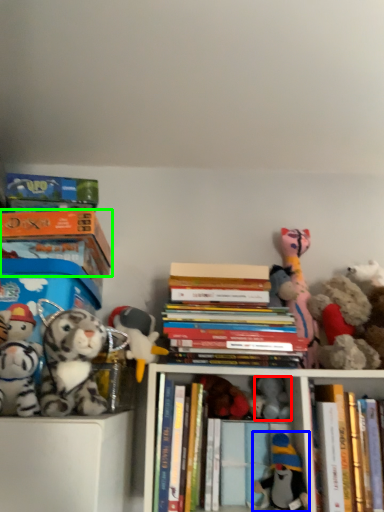
Question: Based on their relative distances, which object is farther from toy (highlighted by a red box)? Choose from toy (highlighted by a blue box) and book (highlighted by a green box).

Choices:
 (A) toy
 (B) book

Answer: (B)